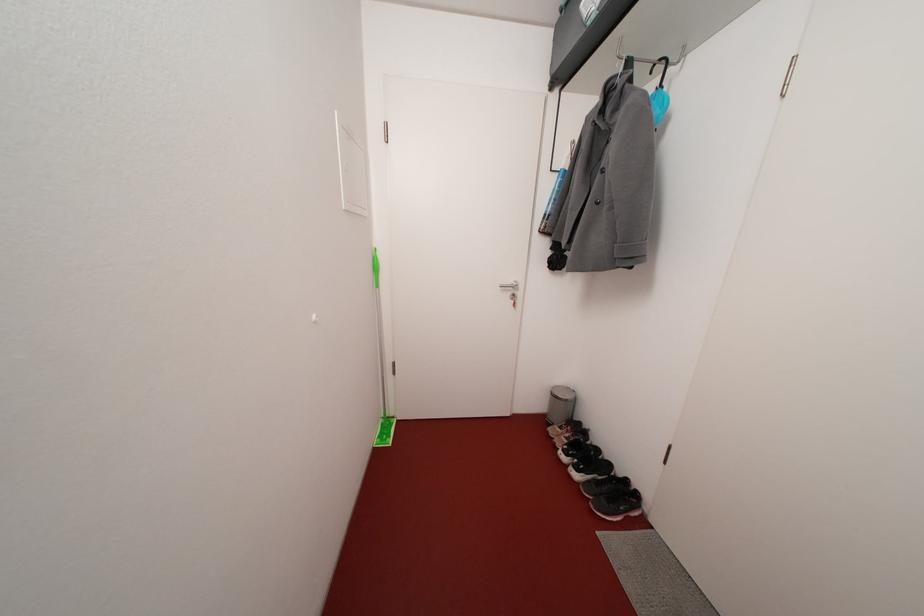
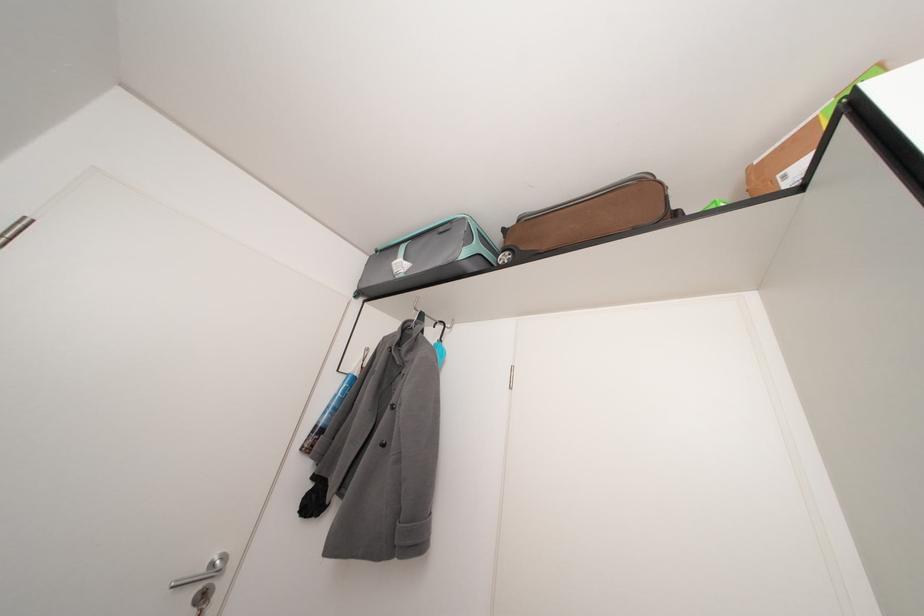
Where in the second image is the point corresponding to (x=667, y=63) from the first image?

(447, 328)